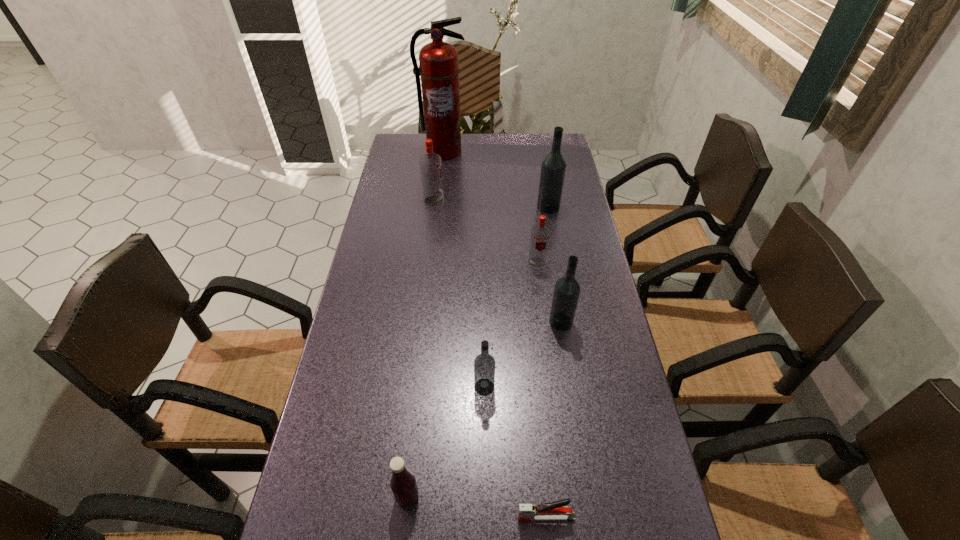
Find the location of a particular element. Image resolution: width=960 pixels, height=540 pixels. vacant space located 0.140m on the back of the smallest black vodka is located at coordinates (484, 333).

Locate an element on the screen. This screenshot has height=540, width=960. vacant space located 0.220m on the front label of the nearer red vodka is located at coordinates (545, 326).

Identify the location of free region located on the back of the white Tabasco sauce. This screenshot has height=540, width=960. (421, 364).

Where is `free space located 0.140m on the handle side of the nearest object`? This screenshot has width=960, height=540. free space located 0.140m on the handle side of the nearest object is located at coordinates (446, 517).

At what (x,y) coordinates should I click in order to perform the action: click on free space located 0.320m on the handle side of the nearest object. Please return your answer as a coordinate pair (x, y). This screenshot has width=960, height=540. Looking at the image, I should click on (356, 517).

At what (x,y) coordinates should I click in order to perform the action: click on vacant position located on the handle side of the nearest object. Please return your answer as a coordinate pair (x, y). Looking at the image, I should click on point(386,517).

The image size is (960, 540). I want to click on object that is at the far edge, so click(439, 68).

At what (x,y) coordinates should I click in order to perform the action: click on fire extinguisher that is at the left edge. Please return your answer as a coordinate pair (x, y). Looking at the image, I should click on (439, 68).

Locate an element on the screen. This screenshot has height=540, width=960. vodka present at the left edge is located at coordinates (430, 163).

The height and width of the screenshot is (540, 960). Identify the location of object located in the far left corner section of the desktop. (439, 68).